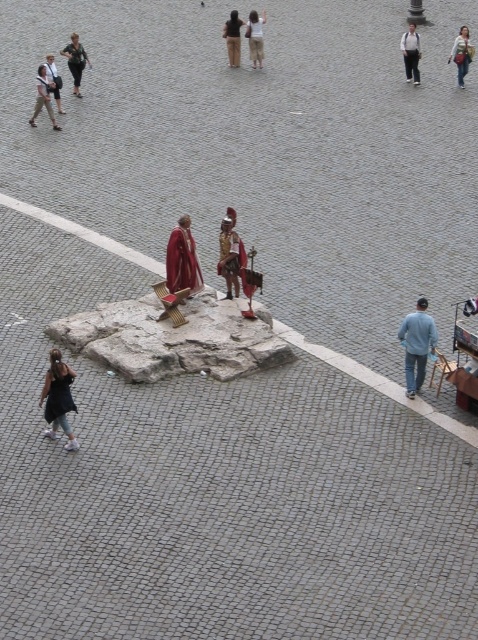
You are a photographer standing in the plaza and want to capture both the black denim jeans at lower left and the brown leather jacket at center in a single photo. Which object should you focus on first to ensure both are in frame?

You should focus on the black denim jeans at lower left first because it is much taller than the brown leather jacket at center, so adjusting the camera angle to include its height will naturally include the shorter jacket in the frame.

You are a photographer trying to capture a clear shot of the khaki pants at left and the matte black backpack at upper left in the plaza. Since you want both subjects to be in focus, which one should you focus on first to ensure depth of field covers both?

The khaki pants at left is much taller than the matte black backpack at upper left, so focusing on the khaki pants at left first will ensure the depth of field includes both subjects.

You are standing at the edge of the cobblestone plaza and notice two items on the ground. You see the black denim jeans at lower left and the brown leather jacket at center. Which item is closer to your left side?

The black denim jeans at lower left is closer to your left side because it is positioned to the left of the brown leather jacket at center.